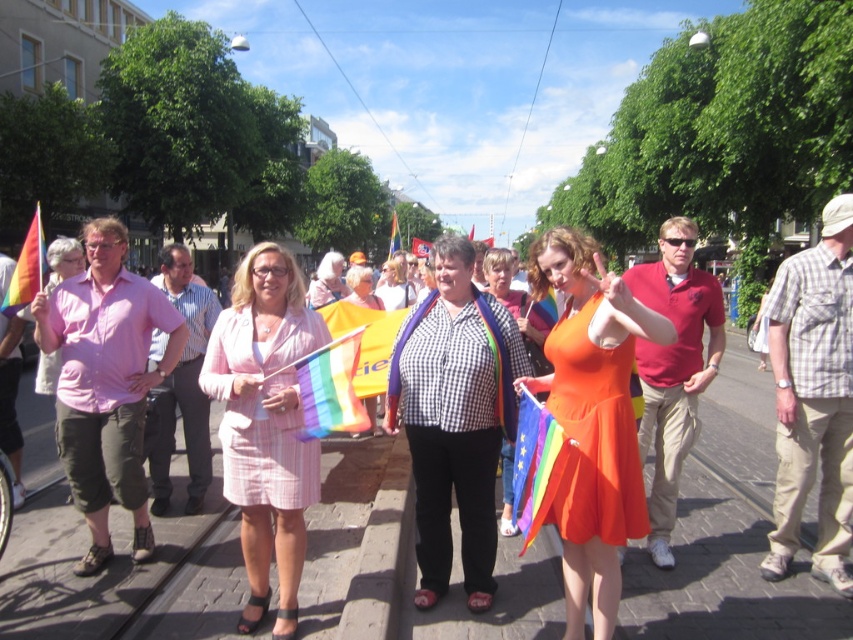
Between pink checkered suit at center and orange cotton dress at center, which one appears on the right side from the viewer's perspective?

From the viewer's perspective, orange cotton dress at center appears more on the right side.

Is pink checkered suit at center positioned before orange cotton dress at center?

Yes, pink checkered suit at center is closer to the viewer.

Is point (289, 560) positioned before point (361, 276)?

Yes, point (289, 560) is in front of point (361, 276).

At what (x,y) coordinates should I click in order to perform the action: click on pink checkered suit at center. Please return your answer as a coordinate pair (x, y). Image resolution: width=853 pixels, height=640 pixels. Looking at the image, I should click on (265, 424).

Is orange satin dress at center closer to the viewer compared to pink checkered suit at center?

Yes, orange satin dress at center is in front of pink checkered suit at center.

Is orange satin dress at center shorter than pink checkered suit at center?

In fact, orange satin dress at center may be taller than pink checkered suit at center.

Between point (587, 412) and point (247, 445), which one is positioned behind?

Point (247, 445)

Locate an element on the screen. The height and width of the screenshot is (640, 853). orange satin dress at center is located at coordinates (592, 419).

How much distance is there between orange satin dress at center and orange cotton dress at center?

orange satin dress at center and orange cotton dress at center are 4.90 meters apart from each other.

Does point (575, 531) lie behind point (375, 400)?

No, it is in front of (375, 400).

At what (x,y) coordinates should I click in order to perform the action: click on orange satin dress at center. Please return your answer as a coordinate pair (x, y). The image size is (853, 640). Looking at the image, I should click on (592, 419).

This screenshot has width=853, height=640. In order to click on orange satin dress at center in this screenshot , I will do `click(592, 419)`.